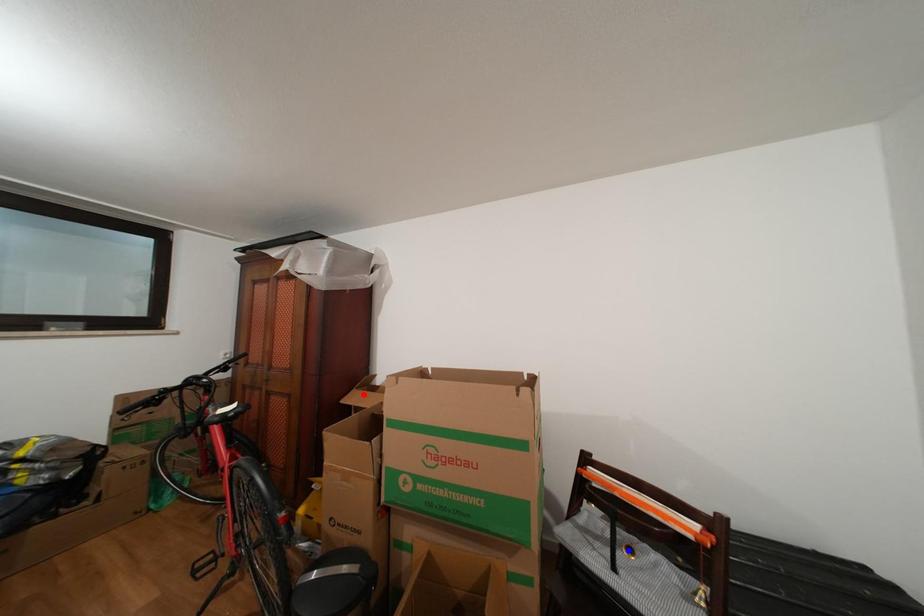
Question: Which of the two points in the image is closer to the camera?

Choices:
 (A) Blue point is closer.
 (B) Red point is closer.

Answer: (A)